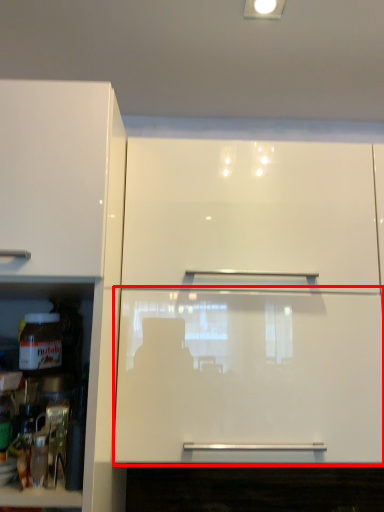
Question: In this image, where is glass door (annotated by the red box) located relative to cabinetry?

Choices:
 (A) right
 (B) left

Answer: (A)